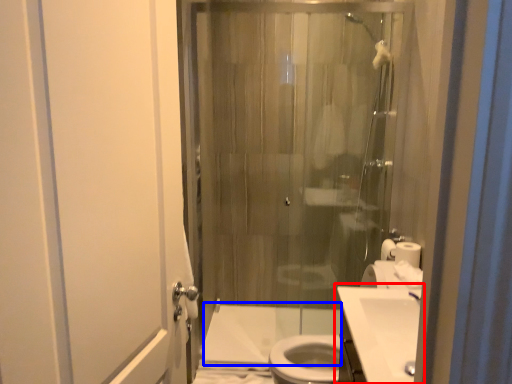
Question: Which object is closer to the camera taking this photo, sink (highlighted by a red box) or bath (highlighted by a blue box)?

Choices:
 (A) sink
 (B) bath

Answer: (A)